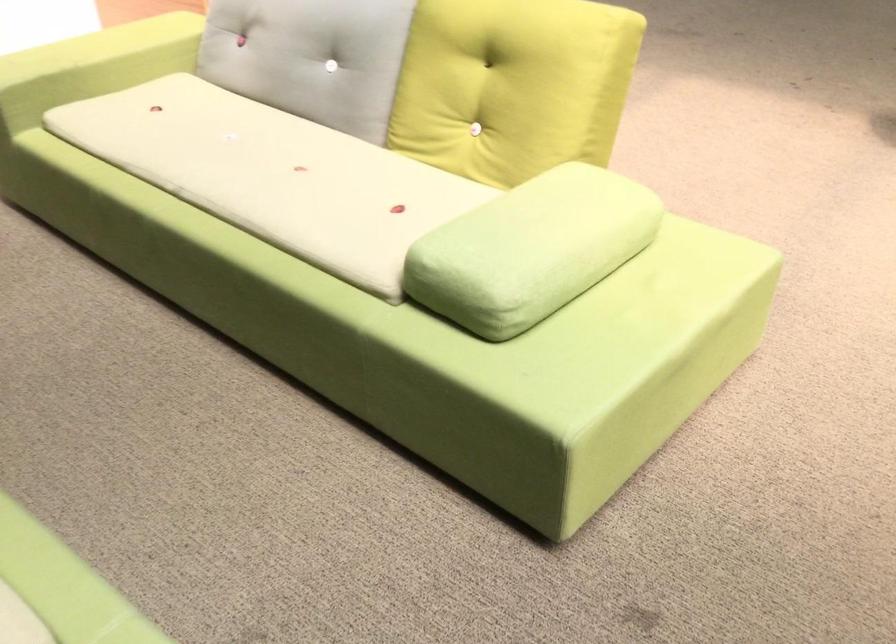
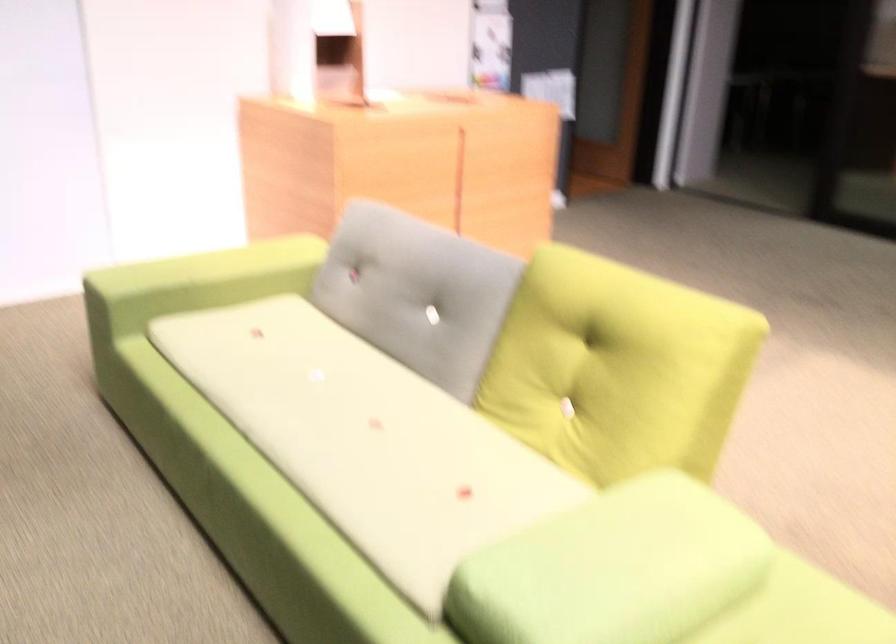
Question: Based on the continuous images, in which direction is the camera rotating? Reply with the corresponding letter.

Choices:
 (A) Left
 (B) Right
 (C) Up
 (D) Down

Answer: (C)